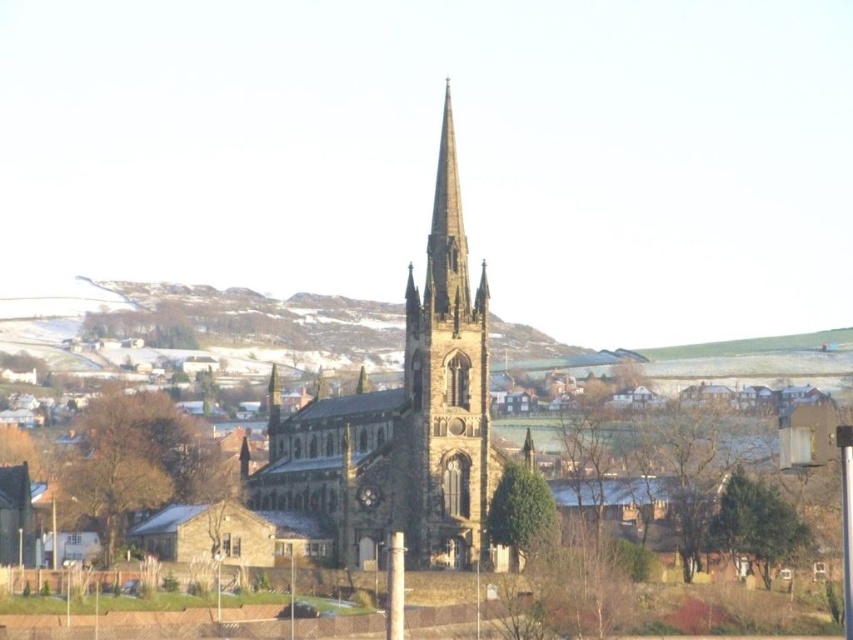
You are a tourist standing in front of the brown stone church at center and the brown stone tower at center. Which structure is taller?

The brown stone church at center is taller than the brown stone tower at center.

You are standing at the camera position and want to take a photo of the brown stone church at center. If your camera has a maximum focus range of 150 meters, will it be able to focus on the church?

The brown stone church at center is 142.94 meters away from the camera. Since this distance is within the camera maximum focus range of 150 meters, the camera can focus on the church.

You are standing in front of the church and want to take a photo. There are two points of interest marked at coordinates point (473, 440) and point (421, 308). Which point is closer to you?

Point (473, 440) is closer to the camera than point (421, 308), so it is the closer point to you.